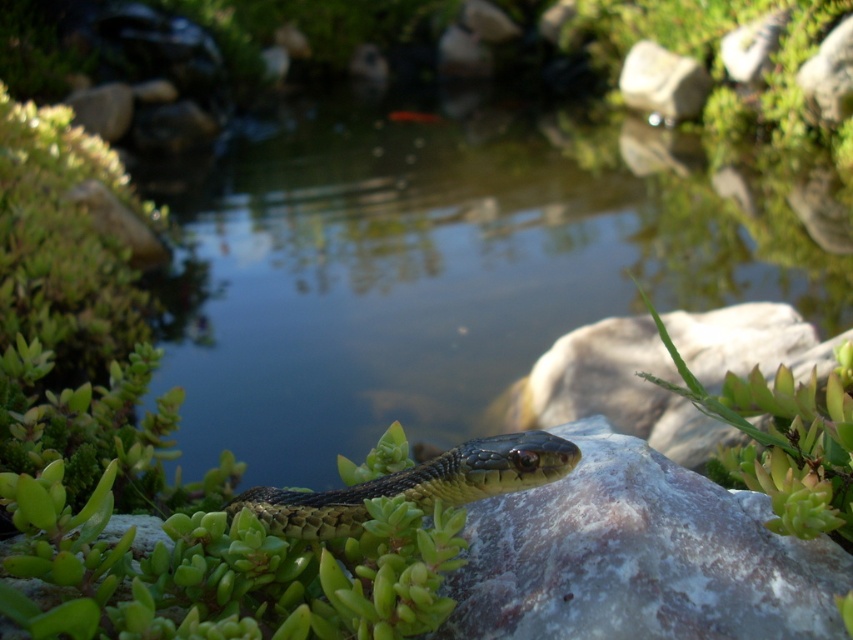
Question: Which point is farther to the camera?

Choices:
 (A) white smooth rock at upper center
 (B) clear water at center

Answer: (A)

Question: Is white marble rock at center bigger than green scaly snake at center?

Choices:
 (A) yes
 (B) no

Answer: (A)

Question: Which of the following is the closest to the observer?

Choices:
 (A) green scaly snake at center
 (B) clear water at center

Answer: (A)

Question: Which point appears closest to the camera in this image?

Choices:
 (A) (543, 282)
 (B) (640, 92)
 (C) (770, 387)

Answer: (C)

Question: Does clear water at center have a smaller size compared to green succulent at upper right?

Choices:
 (A) no
 (B) yes

Answer: (A)

Question: Where is green scaly snake at center located in relation to white smooth rock at upper center in the image?

Choices:
 (A) left
 (B) right

Answer: (A)